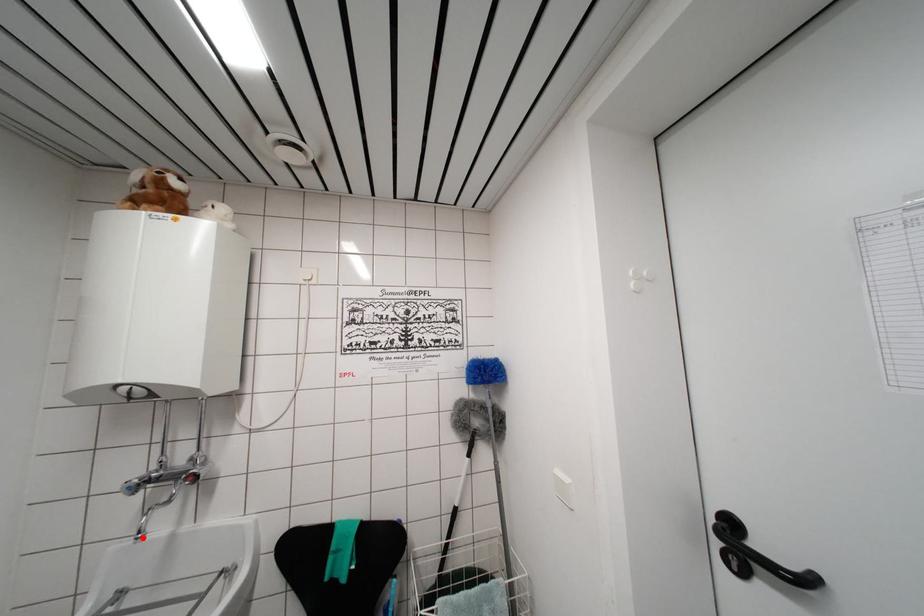
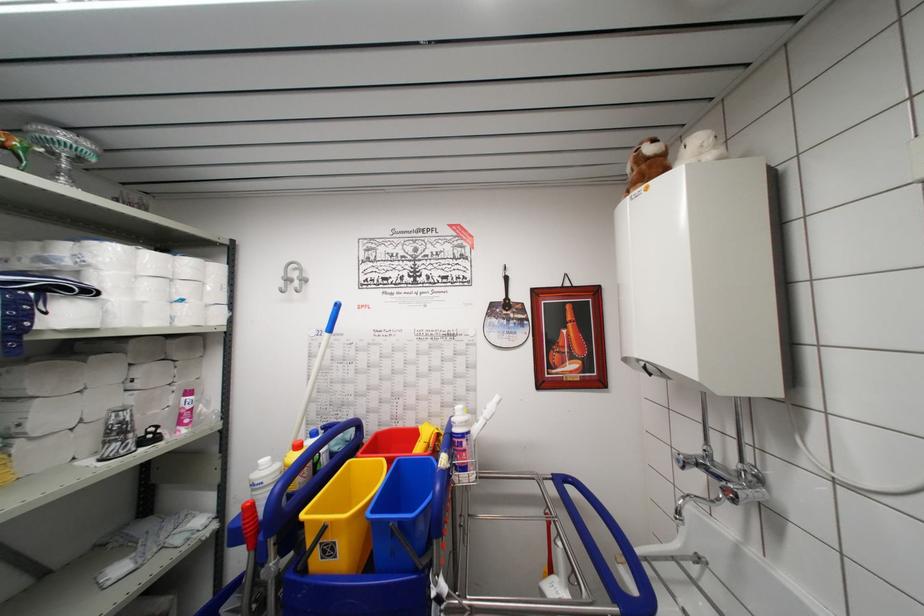
Question: I am providing you with two images of the same scene from different viewpoints. A red point is shown in image1. For the corresponding object point in image2, is it positioned nearer or farther from the camera?

Choices:
 (A) Nearer
 (B) Farther

Answer: (B)